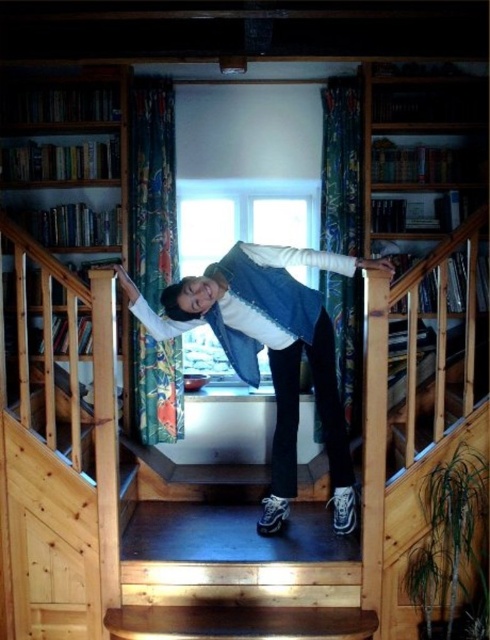
Question: Where is wooden bookshelf at right located in relation to wooden bookshelf at left in the image?

Choices:
 (A) above
 (B) below

Answer: (B)

Question: Which point is farther from the camera taking this photo?

Choices:
 (A) (344, 513)
 (B) (94, 90)

Answer: (B)

Question: Can you confirm if denim vest at center is positioned above wooden bookshelf at right?

Choices:
 (A) yes
 (B) no

Answer: (B)

Question: Which object appears closest to the camera in this image?

Choices:
 (A) wooden bookshelf at left
 (B) denim vest at center
 (C) wooden bookshelf at right

Answer: (B)

Question: Which point is closer to the camera?

Choices:
 (A) wooden bookshelf at right
 (B) denim vest at center

Answer: (B)

Question: Is wooden bookshelf at right to the left of wooden bookshelf at left from the viewer's perspective?

Choices:
 (A) no
 (B) yes

Answer: (A)